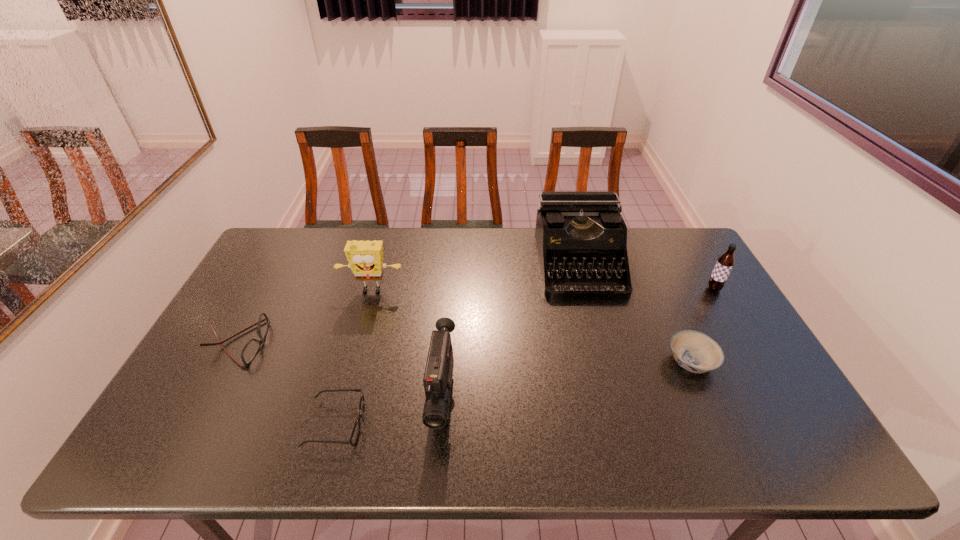
Locate an element on the screen. The height and width of the screenshot is (540, 960). free location at the far edge is located at coordinates (477, 255).

Find the location of a particular element. The image size is (960, 540). vacant space at the left edge of the desktop is located at coordinates (206, 422).

The width and height of the screenshot is (960, 540). In the image, there is a desktop. Identify the location of free space at the right edge. (697, 295).

The width and height of the screenshot is (960, 540). In order to click on vacant space at the far left corner of the desktop in this screenshot , I will do 302,232.

Where is `vacant space at the far right corner of the desktop`? Image resolution: width=960 pixels, height=540 pixels. vacant space at the far right corner of the desktop is located at coordinates pyautogui.click(x=666, y=245).

This screenshot has height=540, width=960. What are the coordinates of `free space at the near right corner of the desktop` in the screenshot? It's located at (778, 426).

The height and width of the screenshot is (540, 960). I want to click on free space between the nearer spectacles and the root beer, so click(x=525, y=357).

You are a GUI agent. You are given a task and a screenshot of the screen. Output one action in this format:
    pyautogui.click(x=<x>, y=<y>)
    Task: Click on the unoccupied position between the bowl and the nearer spectacles
    
    Given the screenshot: What is the action you would take?
    pyautogui.click(x=514, y=393)

The image size is (960, 540). Identify the location of free spot between the leftmost object and the third object from right to left. (407, 303).

In order to click on empty space that is in between the sponge and the bowl in this screenshot , I will do `click(531, 327)`.